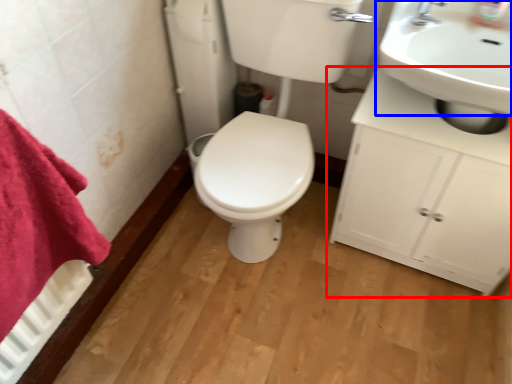
Question: Which of the following is the farthest to the observer, bathroom cabinet (highlighted by a red box) or sink (highlighted by a blue box)?

Choices:
 (A) bathroom cabinet
 (B) sink

Answer: (A)